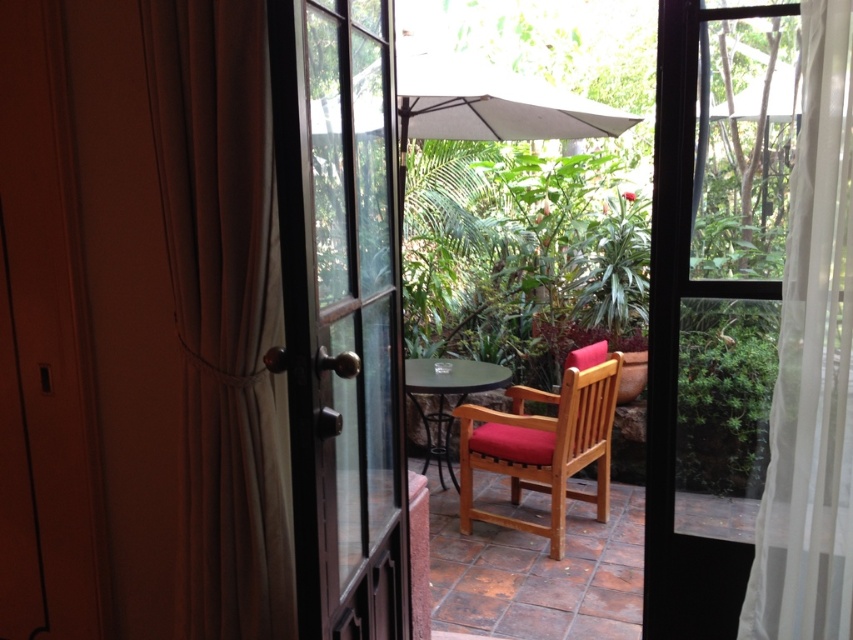
Is teak wood armchair at center above matte black table at center?

No.

At what (x,y) coordinates should I click in order to perform the action: click on teak wood armchair at center. Please return your answer as a coordinate pair (x, y). Looking at the image, I should click on (544, 444).

The width and height of the screenshot is (853, 640). What are the coordinates of `teak wood armchair at center` in the screenshot? It's located at (544, 444).

Locate an element on the screen. white sheer curtain at right is located at coordinates (811, 364).

The height and width of the screenshot is (640, 853). Describe the element at coordinates (811, 364) in the screenshot. I see `white sheer curtain at right` at that location.

Which is behind, point (811, 356) or point (489, 376)?

The point (489, 376) is more distant.

Image resolution: width=853 pixels, height=640 pixels. Identify the location of white sheer curtain at right. (811, 364).

Does point (791, 288) come farther from viewer compared to point (477, 456)?

No, (791, 288) is in front of (477, 456).

Which is in front, point (817, 33) or point (489, 416)?

Point (817, 33) is more forward.

This screenshot has height=640, width=853. In order to click on white sheer curtain at right in this screenshot , I will do `click(811, 364)`.